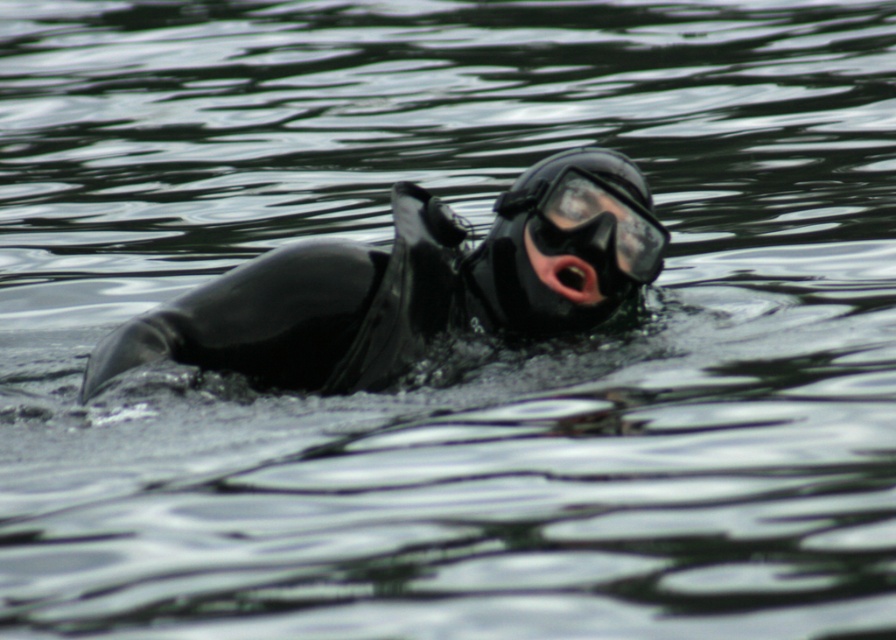
Question: Is black rubber diver at center smaller than black matte/glossy mask at center?

Choices:
 (A) yes
 (B) no

Answer: (B)

Question: From the image, what is the correct spatial relationship of black rubber diver at center in relation to pink matte skin at center?

Choices:
 (A) right
 (B) left

Answer: (B)

Question: Can you confirm if black matte/glossy mask at center is bigger than pink matte skin at center?

Choices:
 (A) yes
 (B) no

Answer: (A)

Question: Estimate the real-world distances between objects in this image. Which object is closer to the pink matte skin at center?

Choices:
 (A) black rubber diver at center
 (B) black matte/glossy mask at center

Answer: (B)

Question: Which point is closer to the camera?

Choices:
 (A) black rubber diver at center
 (B) black matte/glossy mask at center
 (C) pink matte skin at center

Answer: (A)

Question: Which object is the farthest from the black matte/glossy mask at center?

Choices:
 (A) pink matte skin at center
 (B) black rubber diver at center

Answer: (B)